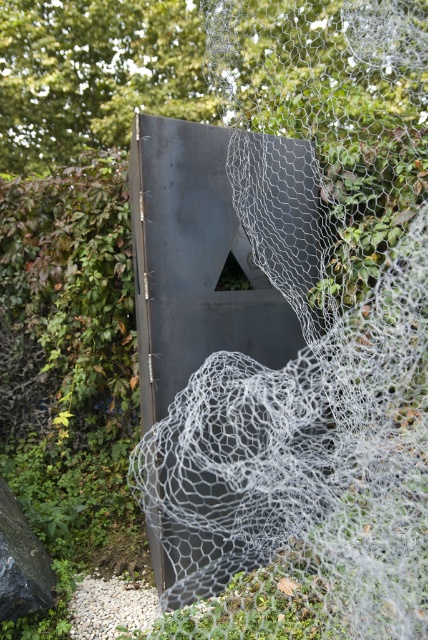
Does white mesh netting at center have a lesser width compared to green leafy hedge at left?

Incorrect, white mesh netting at center's width is not less than green leafy hedge at left's.

Between white mesh netting at center and green leafy hedge at left, which one appears on the left side from the viewer's perspective?

green leafy hedge at left

Which is in front, point (422, 316) or point (92, 282)?

Point (422, 316) is in front.

This screenshot has width=428, height=640. I want to click on white mesh netting at center, so click(x=294, y=438).